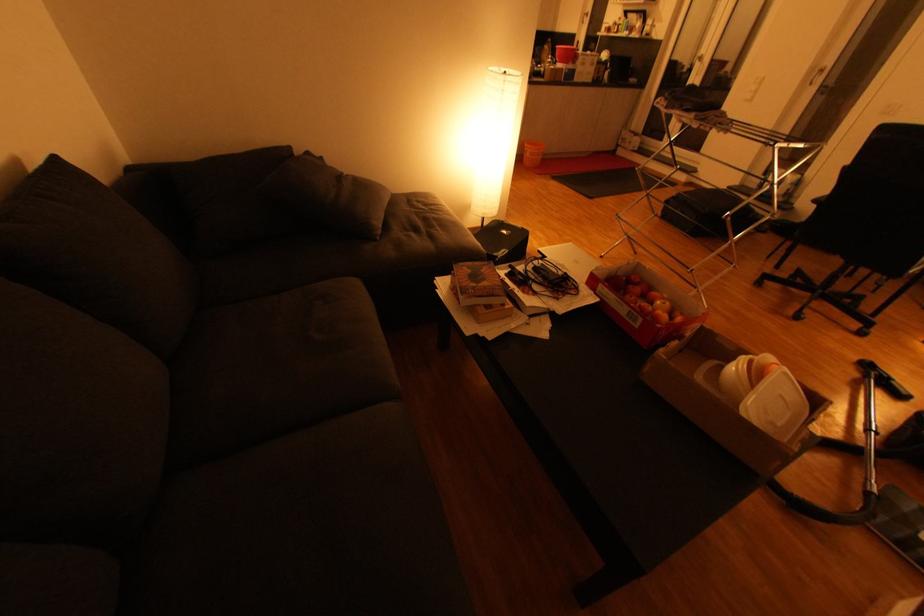
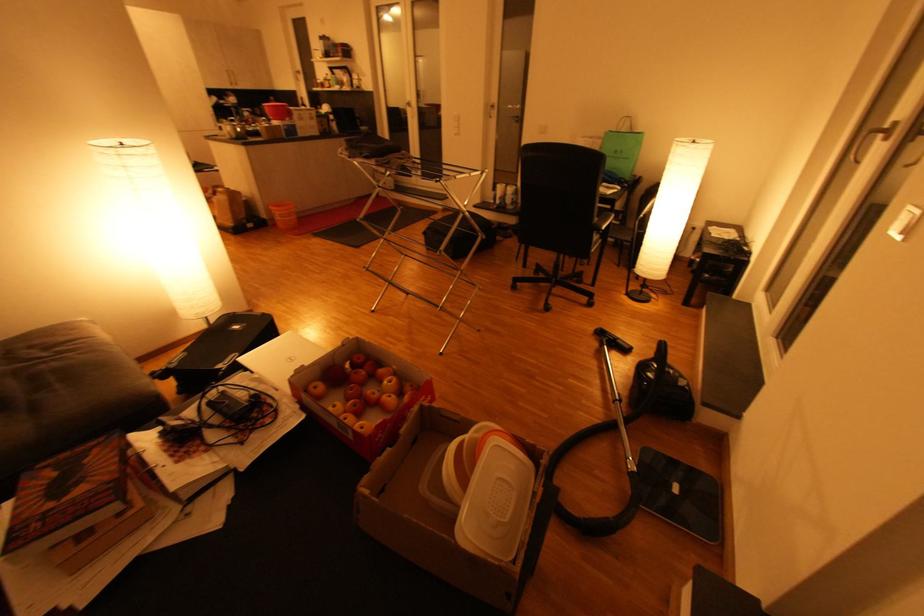
Locate, in the second image, the point that corresponds to pixel 771 277 in the first image.

(520, 281)